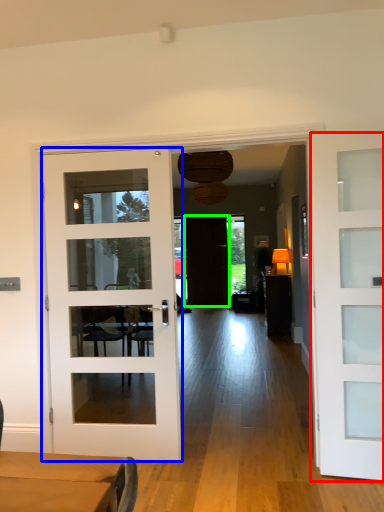
Question: Which object is positioned farthest from door (highlighted by a red box)? Select from door (highlighted by a blue box) and door (highlighted by a green box).

Choices:
 (A) door
 (B) door

Answer: (B)